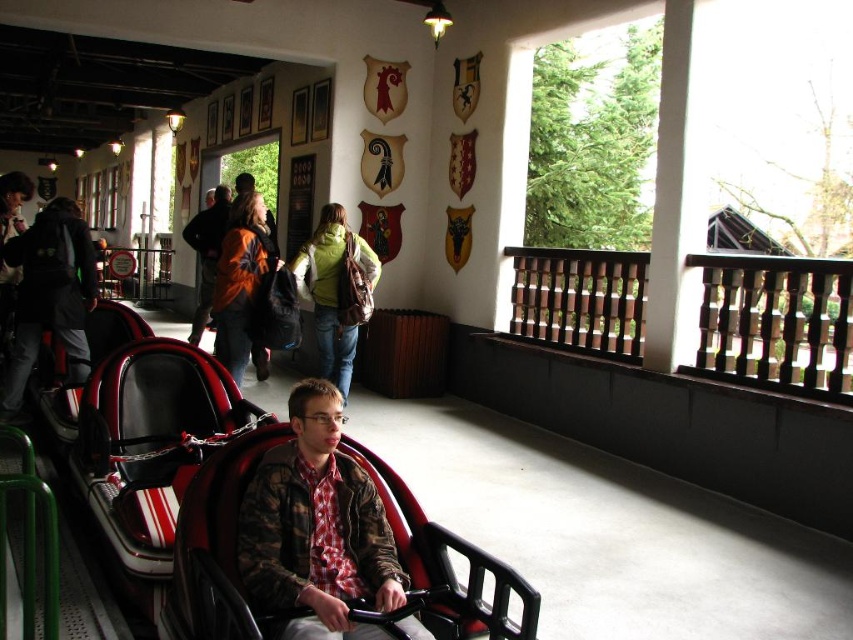
Question: Which object is positioned farthest from the orange jacket at center?

Choices:
 (A) camouflage-patterned seat at center
 (B) green fabric jacket at center
 (C) matte black backpack at left

Answer: (A)

Question: Considering the relative positions of matte black backpack at left and green fabric jacket at center in the image provided, where is matte black backpack at left located with respect to green fabric jacket at center?

Choices:
 (A) left
 (B) right

Answer: (A)

Question: Estimate the real-world distances between objects in this image. Which object is farther from the green fabric jacket at center?

Choices:
 (A) camouflage jacket at center
 (B) orange jacket at center

Answer: (A)

Question: Is matte black backpack at left in front of green fabric jacket at center?

Choices:
 (A) no
 (B) yes

Answer: (B)

Question: Which object is closer to the camera taking this photo?

Choices:
 (A) camouflage jacket at center
 (B) green fabric jacket at center
 (C) orange jacket at center
 (D) matte black backpack at left

Answer: (A)

Question: From the image, what is the correct spatial relationship of green fabric jacket at center in relation to orange jacket at center?

Choices:
 (A) right
 (B) left

Answer: (A)